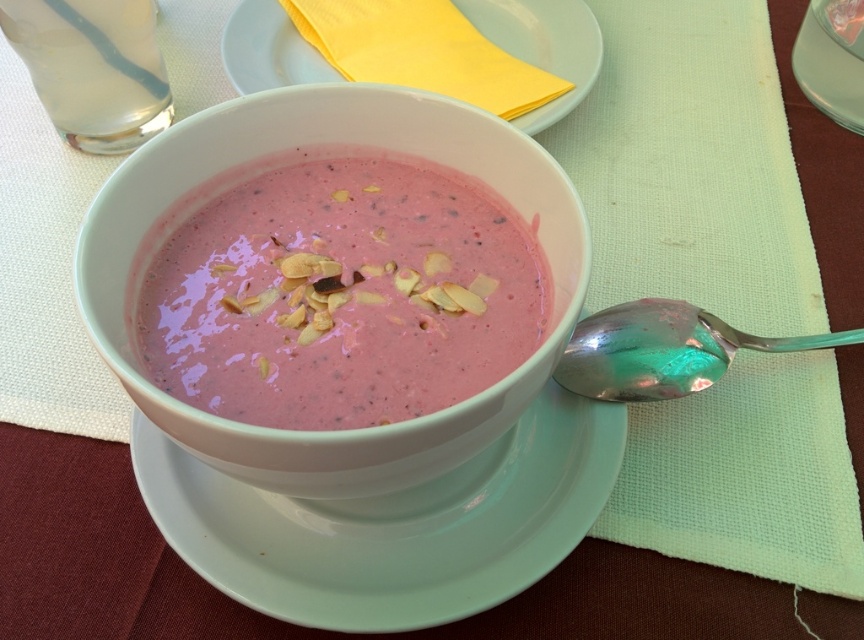
Is white glossy plate at center positioned before silver metallic spoon at lower right?

That is True.

Can you confirm if white glossy plate at center is bigger than silver metallic spoon at lower right?

Yes, white glossy plate at center is bigger than silver metallic spoon at lower right.

What do you see at coordinates (392, 524) in the screenshot?
I see `white glossy plate at center` at bounding box center [392, 524].

Where is `white glossy plate at center`? white glossy plate at center is located at coordinates (392, 524).

Between matte ceramic bowl at center and white ceramic plate at upper center, which one has less height?

With less height is white ceramic plate at upper center.

Does matte ceramic bowl at center come in front of white ceramic plate at upper center?

Yes, it is.

Who is more forward, (291, 104) or (262, 42)?

Point (291, 104) is in front.

The image size is (864, 640). Identify the location of matte ceramic bowl at center. (314, 157).

Between matte ceramic bowl at center and white glossy plate at center, which one appears on the right side from the viewer's perspective?

From the viewer's perspective, white glossy plate at center appears more on the right side.

Does matte ceramic bowl at center appear on the right side of white glossy plate at center?

In fact, matte ceramic bowl at center is to the left of white glossy plate at center.

This screenshot has height=640, width=864. Identify the location of matte ceramic bowl at center. (314, 157).